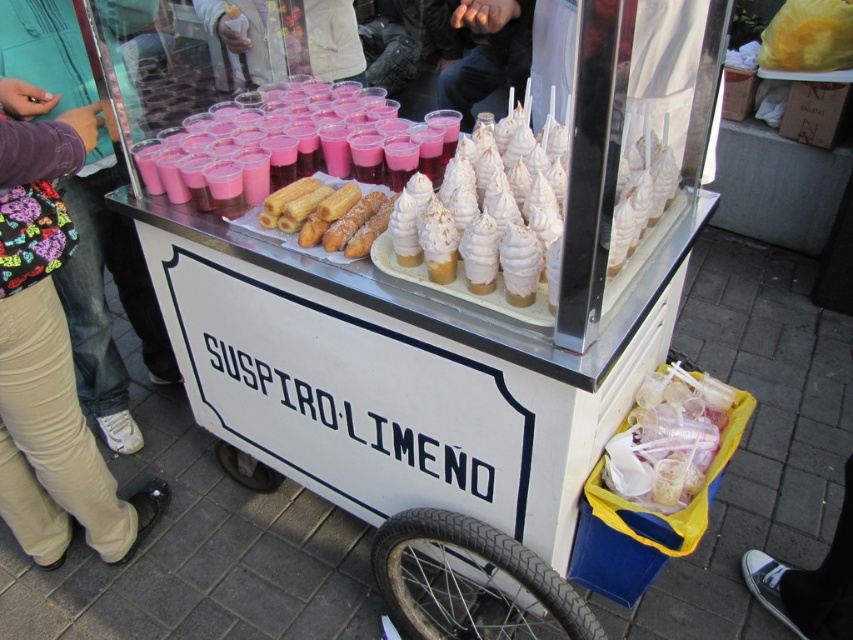
Question: Is pink plastic cups at center to the left of white cotton shirt at upper center from the viewer's perspective?

Choices:
 (A) yes
 (B) no

Answer: (B)

Question: Can you confirm if tan pants at lower left is positioned above white creamy ice cream cone at center?

Choices:
 (A) no
 (B) yes

Answer: (A)

Question: Is white whipped cream at center thinner than pink plastic cups at center?

Choices:
 (A) no
 (B) yes

Answer: (B)

Question: Which object appears closest to the camera in this image?

Choices:
 (A) white cotton shirt at upper center
 (B) clear plastic cups at lower right
 (C) white whipped cream at center
 (D) white creamy ice cream cone at center

Answer: (C)

Question: Which object is farther from the camera taking this photo?

Choices:
 (A) tan pants at lower left
 (B) white soft serve ice cream cone at center
 (C) white cotton shirt at upper center
 (D) pink plastic cups at center

Answer: (C)

Question: Which object appears farthest from the camera in this image?

Choices:
 (A) white cotton shirt at upper center
 (B) golden fried pastry at center

Answer: (A)